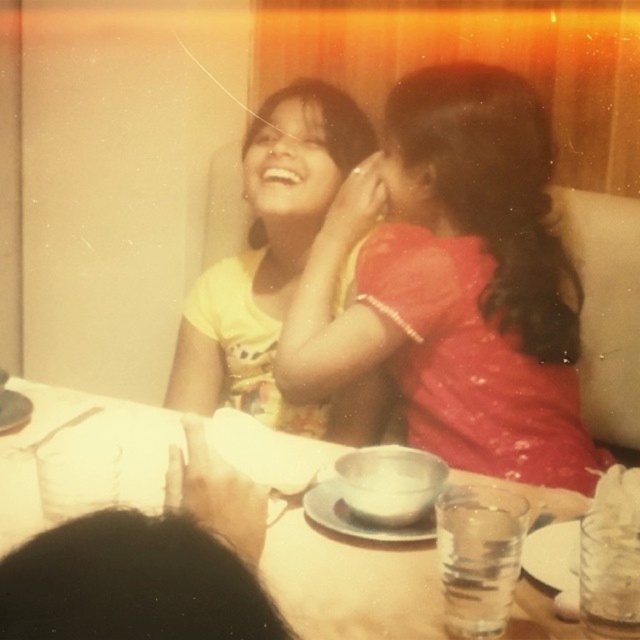
Question: Does white paper napkin at upper left appear on the right side of black hair at lower left?

Choices:
 (A) no
 (B) yes

Answer: (A)

Question: Is matte red dress at center above white paper napkin at upper left?

Choices:
 (A) no
 (B) yes

Answer: (B)

Question: Does matte red dress at center have a greater width compared to white paper napkin at upper left?

Choices:
 (A) no
 (B) yes

Answer: (A)

Question: Which point is closer to the camera?

Choices:
 (A) matte red dress at center
 (B) white paper napkin at upper left

Answer: (B)

Question: Which point is closer to the camera?

Choices:
 (A) matte red dress at center
 (B) black hair at lower left
 (C) white paper napkin at upper left
 (D) yellow printed fabric at upper left

Answer: (B)

Question: Which of the following is the closest to the observer?

Choices:
 (A) (520, 291)
 (B) (310, 634)
 (C) (93, 513)
 (D) (200, 280)

Answer: (C)